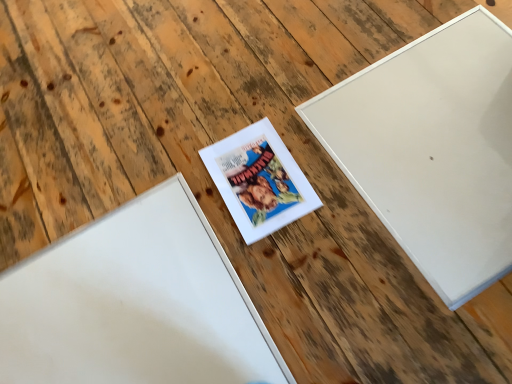
Locate an element on the screen. free area in between white matte picture frame at center, the 3th picture frame in the right-to-left sequence, and white matte picture frame at upper right, arranged as the first picture frame when viewed from the right is located at coordinates point(293,234).